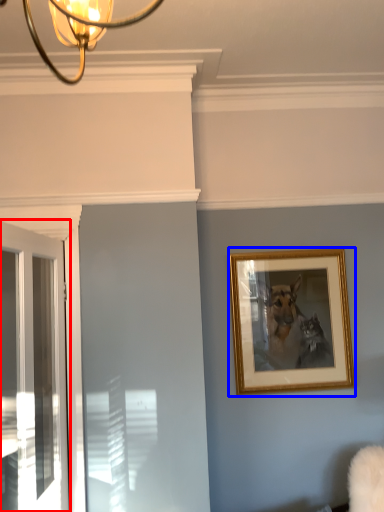
Question: Which object is closer to the camera taking this photo, door (highlighted by a red box) or picture frame (highlighted by a blue box)?

Choices:
 (A) door
 (B) picture frame

Answer: (A)